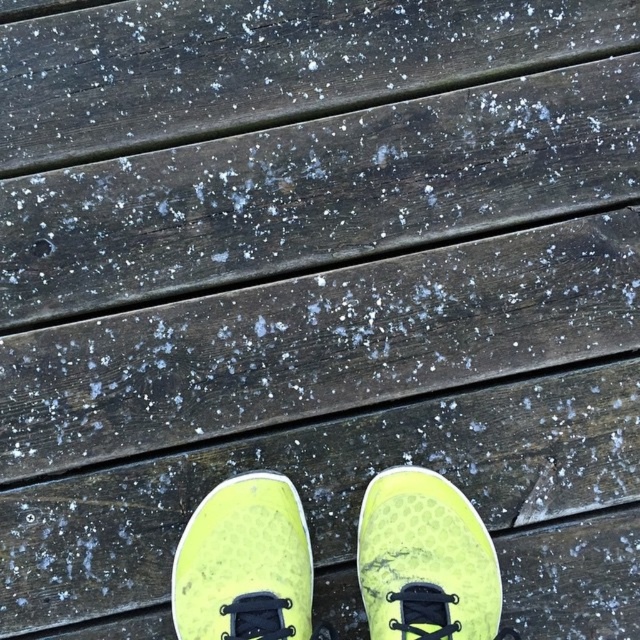
Question: Can you confirm if neon yellow fabric shoe at center is thinner than neon yellow mesh shoe at center?

Choices:
 (A) no
 (B) yes

Answer: (B)

Question: Does neon yellow fabric shoe at center come in front of neon yellow mesh shoe at center?

Choices:
 (A) yes
 (B) no

Answer: (B)

Question: Among these objects, which one is nearest to the camera?

Choices:
 (A) neon yellow mesh shoe at center
 (B) neon yellow fabric shoe at center

Answer: (A)

Question: Among these objects, which one is nearest to the camera?

Choices:
 (A) neon yellow fabric shoe at center
 (B) neon yellow mesh shoe at center

Answer: (B)

Question: Is neon yellow fabric shoe at center further to the viewer compared to neon yellow mesh shoe at center?

Choices:
 (A) no
 (B) yes

Answer: (B)